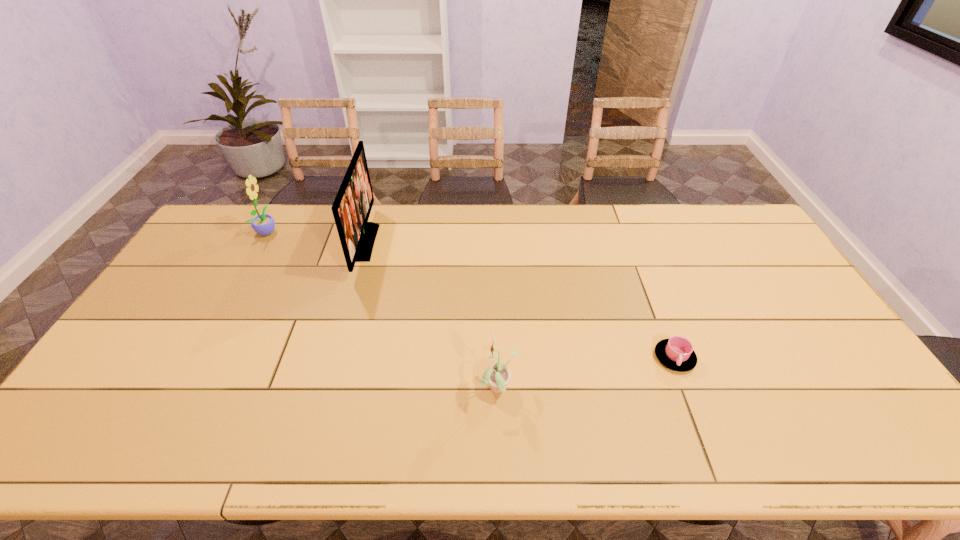
You are a GUI agent. You are given a task and a screenshot of the screen. Output one action in this format:
    pyautogui.click(x=<x>, y=<y>)
    Task: Click on the vacant space located on the front-facing side of the second object from right to left
    The image size is (960, 540).
    Given the screenshot: What is the action you would take?
    pyautogui.click(x=382, y=390)

You are a GUI agent. You are given a task and a screenshot of the screen. Output one action in this format:
    pyautogui.click(x=<x>, y=<y>)
    Task: Click on the vacant space situated 0.270m on the front-facing side of the second object from right to left
    This screenshot has width=960, height=540.
    Given the screenshot: What is the action you would take?
    pyautogui.click(x=374, y=390)

Find the location of a particular element. This screenshot has height=540, width=960. free space located 0.060m on the front-facing side of the second object from right to left is located at coordinates (457, 390).

The height and width of the screenshot is (540, 960). I want to click on blank space located 0.150m on the side with the handle of the shortest object, so point(702,429).

Locate an element on the screen. This screenshot has height=540, width=960. monitor that is at the far edge is located at coordinates (351, 209).

You are a GUI agent. You are given a task and a screenshot of the screen. Output one action in this format:
    pyautogui.click(x=<x>, y=<y>)
    Task: Click on the sunflower situated at the far edge
    This screenshot has width=960, height=540.
    Given the screenshot: What is the action you would take?
    pos(263,224)

Locate an element on the screen. The height and width of the screenshot is (540, 960). vacant area at the far edge of the desktop is located at coordinates (401, 207).

In the image, there is a desktop. In order to click on vacant space at the left edge in this screenshot , I will do `click(202, 288)`.

Find the location of `free space between the monitor and the rightmost object`. free space between the monitor and the rightmost object is located at coordinates (519, 300).

Find the location of a particular element. vacant point located between the tallest object and the rightmost object is located at coordinates pos(519,300).